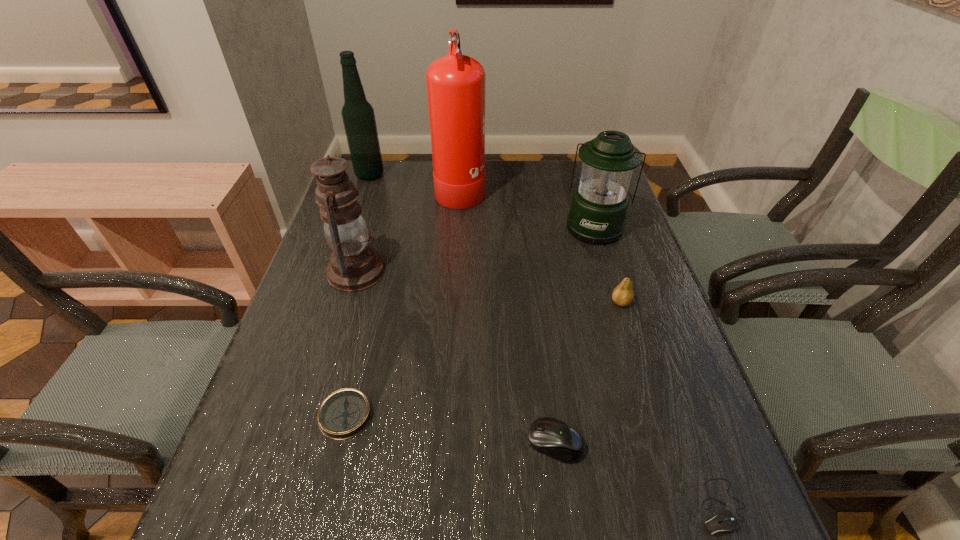
Where is `vacant space at the far edge`? The image size is (960, 540). vacant space at the far edge is located at coordinates (424, 172).

At what (x,y) coordinates should I click in order to perform the action: click on vacant area at the left edge of the desktop. Please return your answer as a coordinate pair (x, y). Looking at the image, I should click on (378, 219).

Locate an element on the screen. The width and height of the screenshot is (960, 540). vacant space at the right edge of the desktop is located at coordinates (620, 311).

At what (x,y) coordinates should I click in order to perform the action: click on free space between the seventh shortest object and the compass. Please return your answer as a coordinate pair (x, y). Looking at the image, I should click on (358, 295).

The width and height of the screenshot is (960, 540). I want to click on empty location between the seventh shortest object and the nearer computer mouse, so (x=545, y=341).

The height and width of the screenshot is (540, 960). Find the location of `unoccupied position between the alcohol and the compass`. unoccupied position between the alcohol and the compass is located at coordinates (358, 295).

You are a GUI agent. You are given a task and a screenshot of the screen. Output one action in this format:
    pyautogui.click(x=<x>, y=<y>)
    Task: Click on the free space between the oil lamp and the compass
    The height and width of the screenshot is (540, 960).
    Given the screenshot: What is the action you would take?
    pyautogui.click(x=351, y=343)

Where is `vacant area that lies between the shorter computer mouse and the lantern`? The image size is (960, 540). vacant area that lies between the shorter computer mouse and the lantern is located at coordinates (659, 366).

You are a GUI agent. You are given a task and a screenshot of the screen. Output one action in this format:
    pyautogui.click(x=<x>, y=<y>)
    Task: Click on the vacant space that is in between the fourth tallest object and the fourth object from right to left
    
    Given the screenshot: What is the action you would take?
    pyautogui.click(x=575, y=335)

The image size is (960, 540). What are the coordinates of `vacant space in between the fourth object from right to left and the right computer mouse` in the screenshot? It's located at (638, 475).